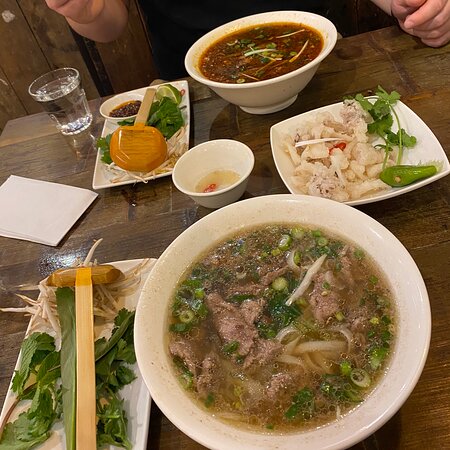
At what (x,y) coordinates should I click in order to perform the action: click on table. Please return your answer as a coordinate pair (x, y). The image size is (450, 450). Looking at the image, I should click on (155, 227).